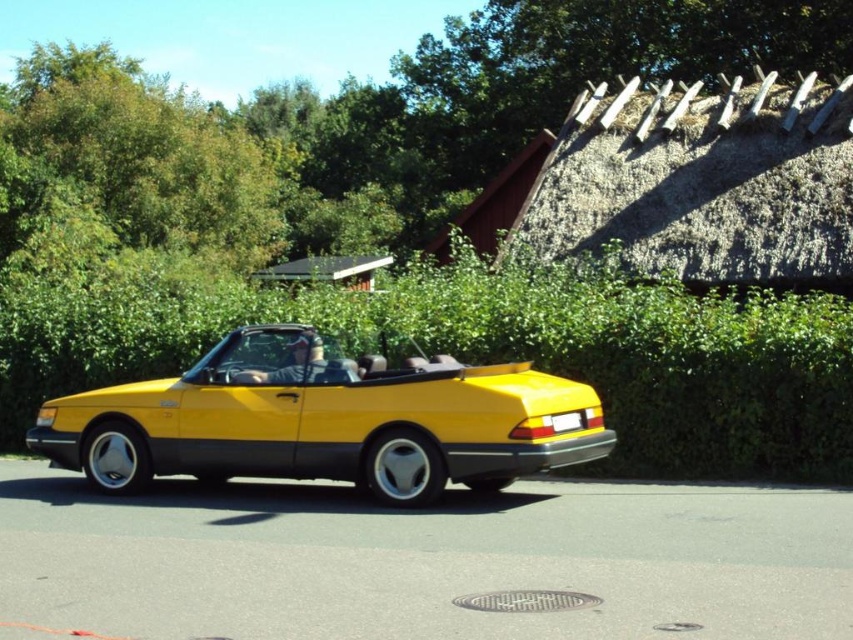
Looking at this image, between yellow matte convertible at center and wooden thatched hut at upper center, which one appears on the right side from the viewer's perspective?

A: wooden thatched hut at upper center is more to the right.

Does yellow matte convertible at center appear on the left side of wooden thatched hut at upper center?

Indeed, yellow matte convertible at center is positioned on the left side of wooden thatched hut at upper center.

What do you see at coordinates (325, 420) in the screenshot?
I see `yellow matte convertible at center` at bounding box center [325, 420].

Image resolution: width=853 pixels, height=640 pixels. I want to click on yellow matte convertible at center, so click(325, 420).

Who is more distant from viewer, (x=546, y=140) or (x=544, y=129)?

Positioned behind is point (x=544, y=129).

The width and height of the screenshot is (853, 640). What do you see at coordinates (688, 182) in the screenshot?
I see `thatched straw roof at upper right` at bounding box center [688, 182].

Which is behind, point (610, 128) or point (482, 234)?

The point (482, 234) is behind.

Where is `thatched straw roof at upper right`? This screenshot has height=640, width=853. thatched straw roof at upper right is located at coordinates (688, 182).

Does green leafy hedge at center come in front of wooden thatched hut at upper center?

Yes, it is.

Measure the distance between green leafy hedge at center and camera.

green leafy hedge at center is 9.81 meters from camera.

Where is `green leafy hedge at center`? Image resolution: width=853 pixels, height=640 pixels. green leafy hedge at center is located at coordinates (500, 352).